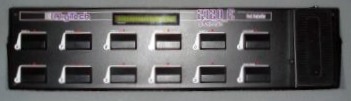
Image resolution: width=351 pixels, height=101 pixels. I want to click on table, so click(x=234, y=95).